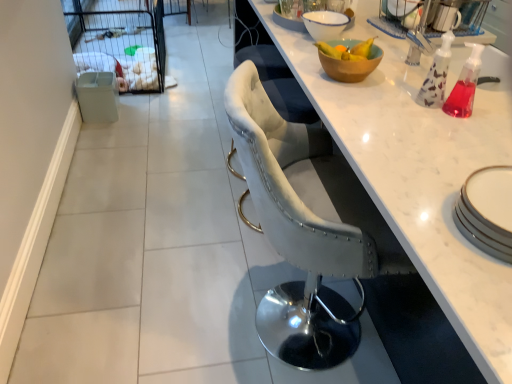
Identify the location of vacant region to the left of velvet grey chair at center. (183, 304).